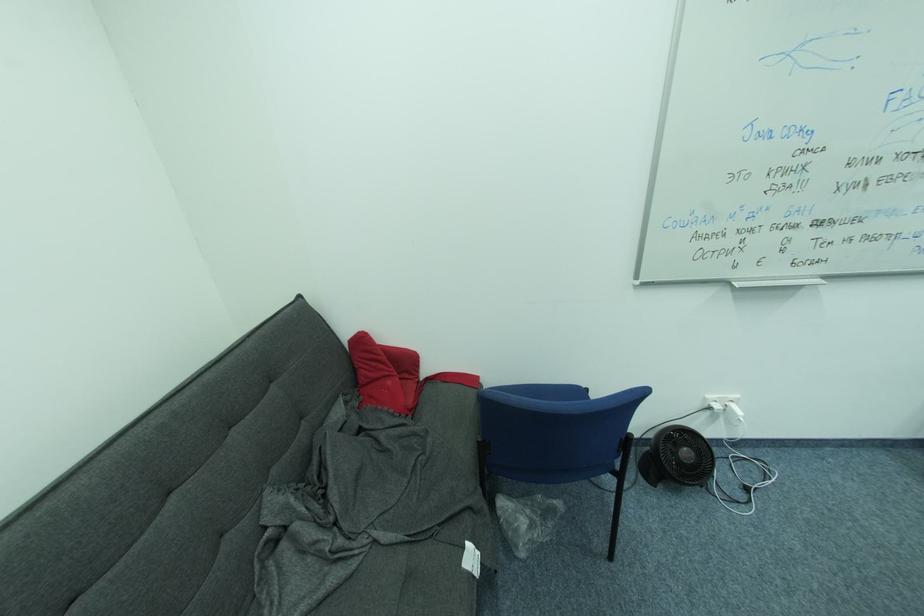
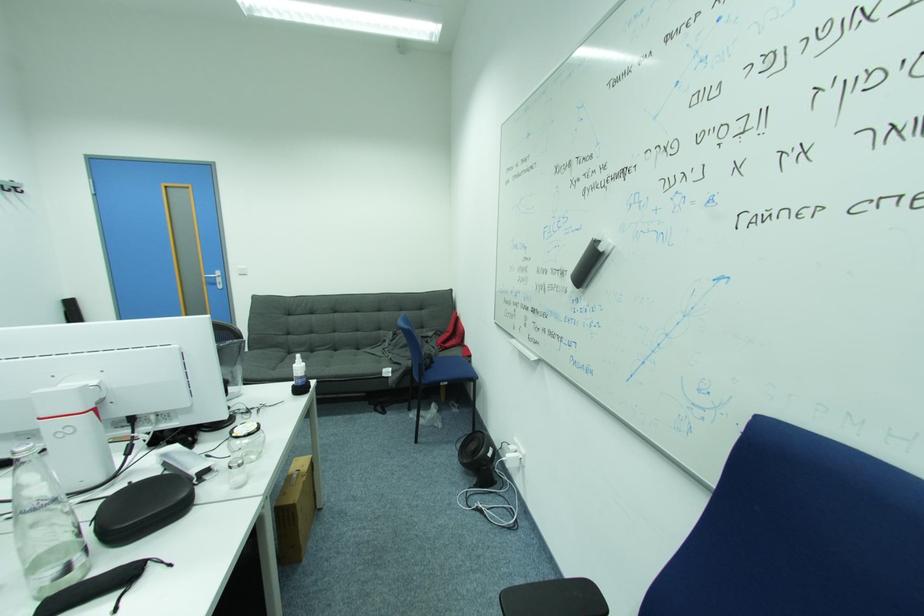
The point at (263, 553) is marked in the first image. Where is the corresponding point in the second image?

(388, 341)